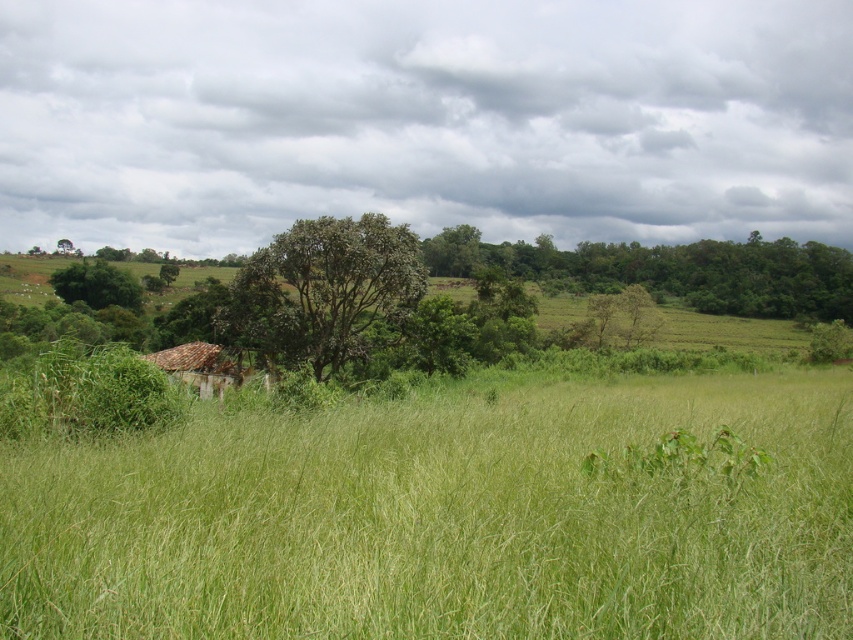
Question: Can you confirm if green grassy field at center is positioned below brown tile roof at center?

Choices:
 (A) no
 (B) yes

Answer: (A)

Question: Is green leafy tree at upper center thinner than green leafy tree at center?

Choices:
 (A) no
 (B) yes

Answer: (A)

Question: Among these points, which one is nearest to the camera?

Choices:
 (A) (105, 280)
 (B) (198, 362)
 (C) (523, 269)
 (D) (364, 224)

Answer: (D)

Question: Among these points, which one is nearest to the camera?

Choices:
 (A) (120, 301)
 (B) (202, 346)
 (C) (680, 412)

Answer: (C)

Question: Does green leafy tree at upper center have a smaller size compared to brown tile roof at center?

Choices:
 (A) yes
 (B) no

Answer: (B)

Question: Among these points, which one is nearest to the camera?

Choices:
 (A) (302, 324)
 (B) (175, 438)
 (C) (202, 356)
 (D) (86, 289)

Answer: (B)